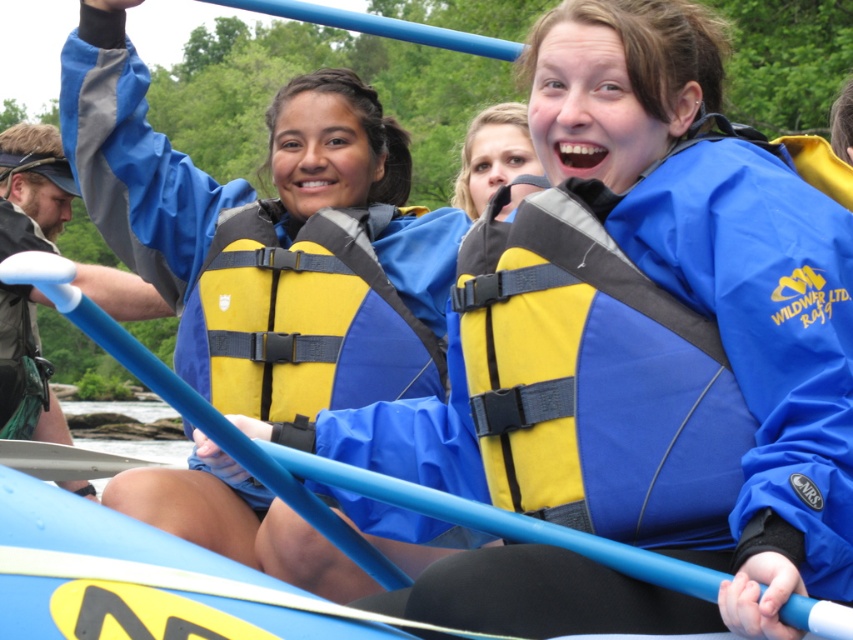
Is point (712, 140) farther from viewer compared to point (106, 468)?

No, (712, 140) is in front of (106, 468).

Which is behind, point (718, 520) or point (41, 472)?

Positioned behind is point (41, 472).

At what (x,y) coordinates should I click in order to perform the action: click on yellow fabric life jacket at upper center. Please return your answer as a coordinate pair (x, y). This screenshot has width=853, height=640. Looking at the image, I should click on (595, 376).

Which is in front, point (6, 403) or point (65, 456)?

Point (65, 456) is in front.

Does yellow fabric life vest at upper center have a lesser height compared to metallic blue paddle at center?

In fact, yellow fabric life vest at upper center may be taller than metallic blue paddle at center.

Is point (114, 280) positioned after point (4, 445)?

Yes, point (114, 280) is behind point (4, 445).

At what (x,y) coordinates should I click in order to perform the action: click on yellow fabric life vest at upper center. Please return your answer as a coordinate pair (x, y). Looking at the image, I should click on (32, 188).

Between matte blue life vest at upper center and metallic blue paddle at center, which one appears on the right side from the viewer's perspective?

Positioned to the right is matte blue life vest at upper center.

Which of these two, matte blue life vest at upper center or metallic blue paddle at center, stands taller?

metallic blue paddle at center is taller.

From the picture: Measure the distance between point (357, 358) and camera.

Point (357, 358) is 50.89 feet away from camera.

The height and width of the screenshot is (640, 853). In order to click on matte blue life vest at upper center in this screenshot , I will do `click(253, 216)`.